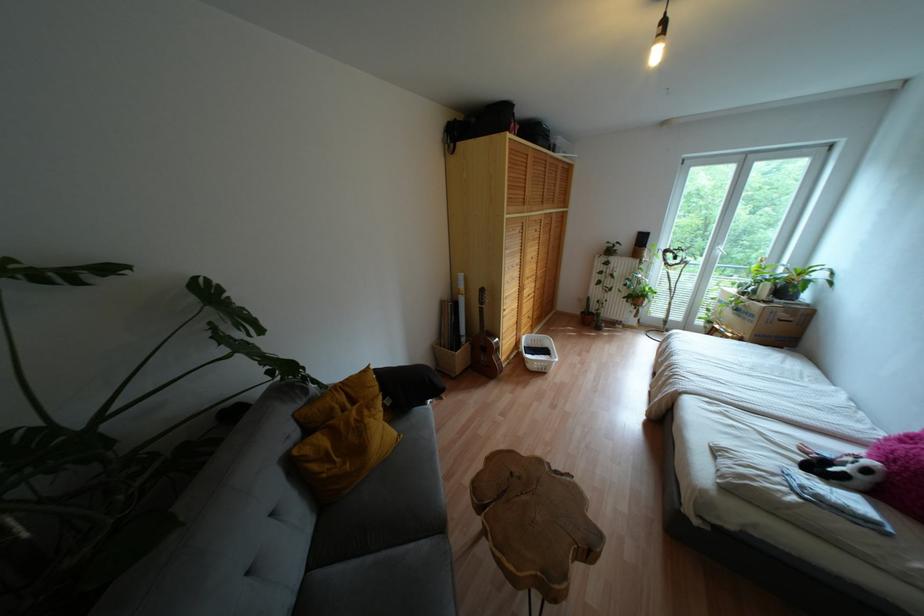
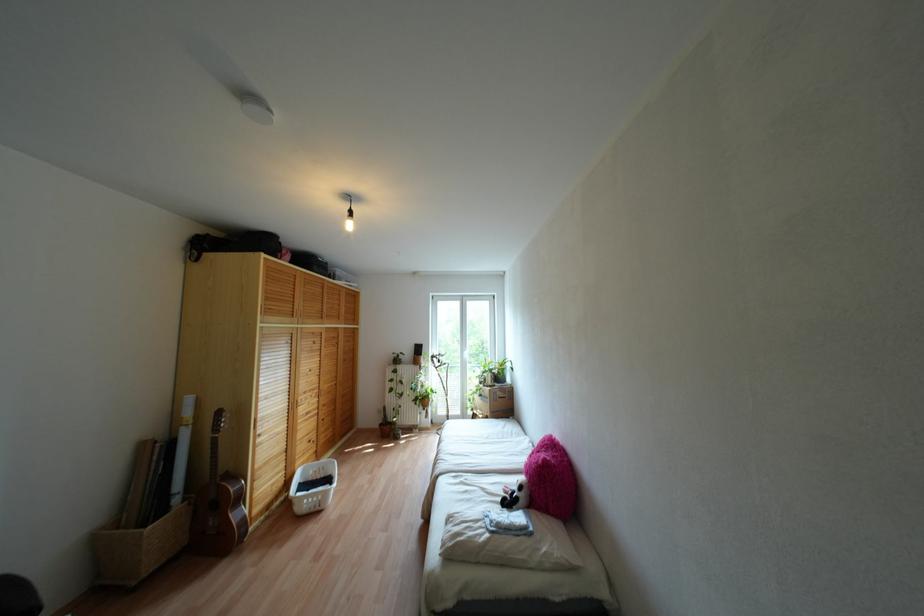
Locate, in the second image, the point that corresponds to (x=760, y=434) in the first image.

(482, 488)